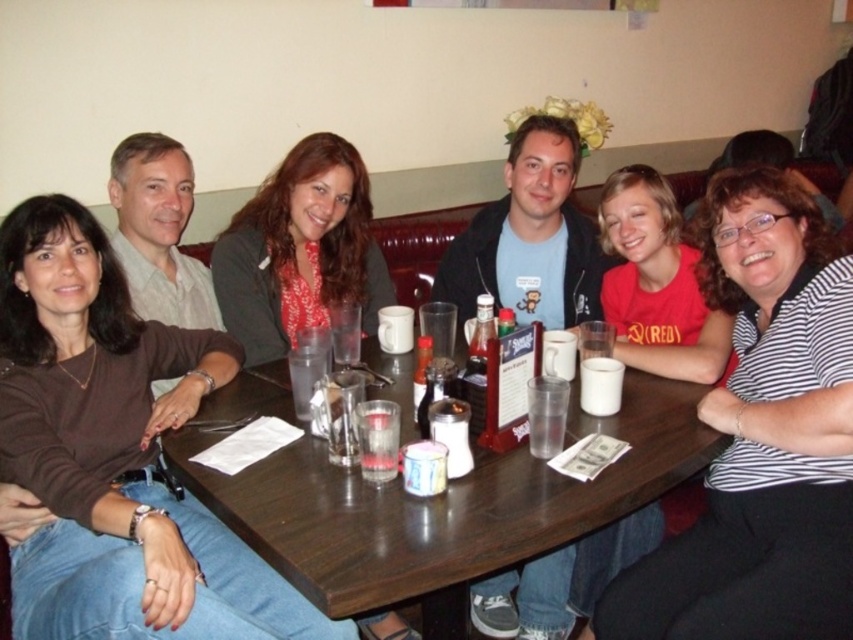
Is white matte cup at table center closer to camera compared to clear plastic cup at table center?

No, white matte cup at table center is further to the viewer.

Is point (581, 403) positioned after point (294, 378)?

Yes, point (581, 403) is behind point (294, 378).

Does point (611, 390) lie in front of point (294, 353)?

Yes, it is.

Locate an element on the screen. The width and height of the screenshot is (853, 640). white matte cup at table center is located at coordinates (601, 385).

Which is more to the left, brown matte shirt at upper left or clear glass at table center?

From the viewer's perspective, brown matte shirt at upper left appears more on the left side.

Between point (39, 262) and point (543, 445), which one is positioned behind?

The point (39, 262) is more distant.

This screenshot has height=640, width=853. What do you see at coordinates (115, 454) in the screenshot?
I see `brown matte shirt at upper left` at bounding box center [115, 454].

Identify the location of brown matte shirt at upper left. (115, 454).

Measure the distance from striped shirt at right to clear glass at table center.

The distance of striped shirt at right from clear glass at table center is 18.30 inches.

Which is in front, point (780, 573) or point (527, 417)?

Point (780, 573) is in front.

Image resolution: width=853 pixels, height=640 pixels. What are the coordinates of `striped shirt at right` in the screenshot? It's located at (762, 438).